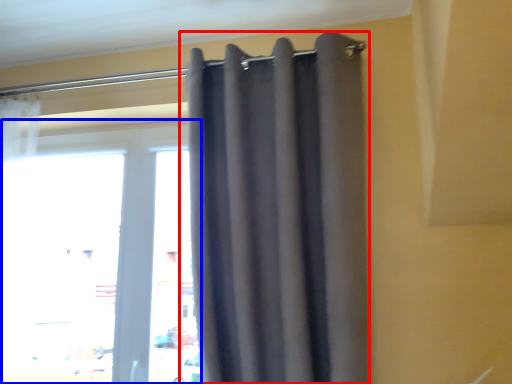
Question: Among these objects, which one is nearest to the camera, curtain (highlighted by a red box) or window (highlighted by a blue box)?

Choices:
 (A) curtain
 (B) window

Answer: (A)